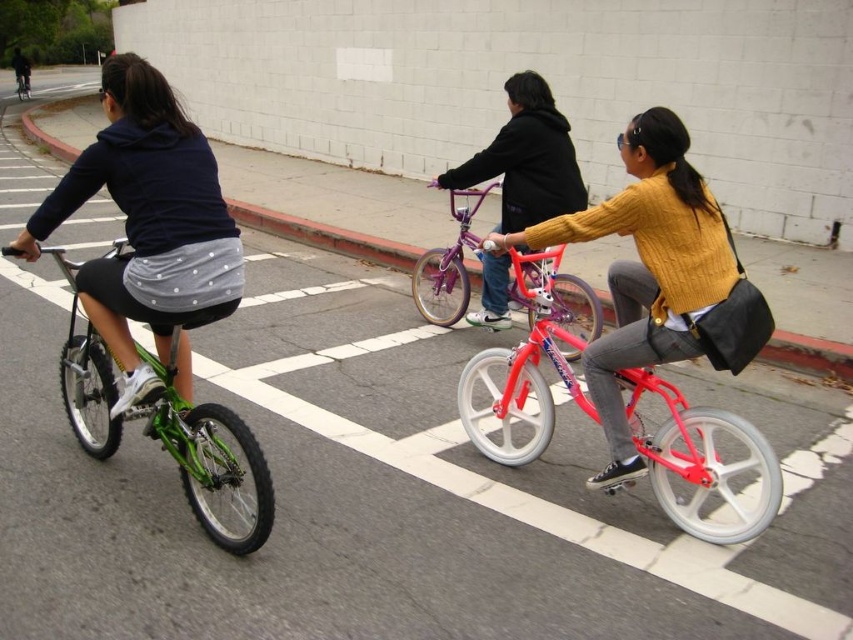
You are a cyclist approaching the two points marked in the image. The first point is at coordinates point (196,186) and the second point is at point (123,241). Which point will you reach first?

Point (196,186) is closer to the viewer than point (123,241), so you will reach point (196,186) first.

You are a pedestrian walking on the red curb side of the road. You see the matte black hoodie at upper left and the green matte bicycle at left. Which one is closer to you?

The matte black hoodie at upper left is closer to you because the green matte bicycle at left is behind it.